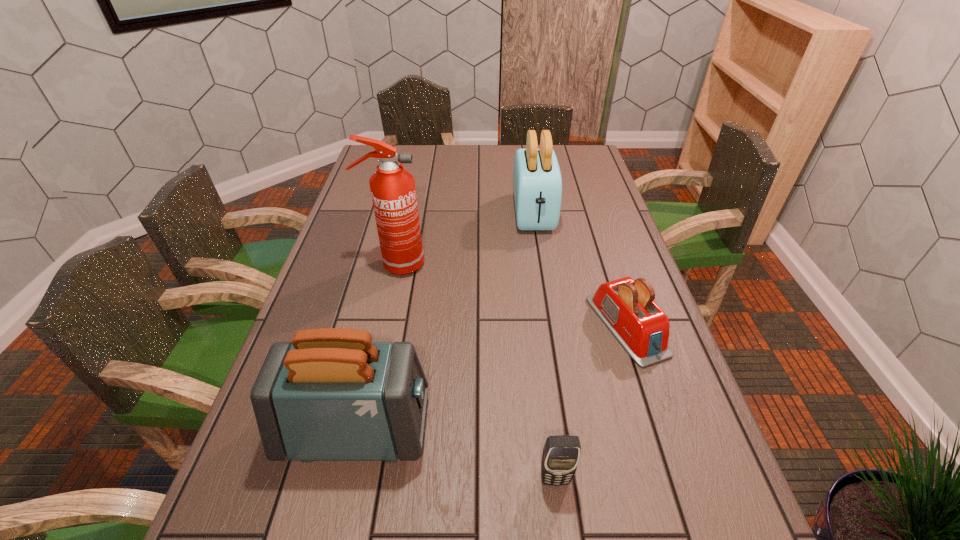
Find the location of a particular element. This screenshot has height=540, width=960. fire extinguisher is located at coordinates (393, 191).

Identify the location of the tallest object. Image resolution: width=960 pixels, height=540 pixels. (393, 191).

Identify the location of the second toaster from right to left. The image size is (960, 540). (537, 184).

The width and height of the screenshot is (960, 540). Find the location of `the farthest object`. the farthest object is located at coordinates (537, 184).

Find the location of a particular element. This screenshot has height=540, width=960. the second nearest object is located at coordinates (331, 394).

Locate an element on the screen. the nearest toaster is located at coordinates (331, 394).

Find the location of a particular element. The height and width of the screenshot is (540, 960). the nearest object is located at coordinates 561,454.

You are a GUI agent. You are given a task and a screenshot of the screen. Output one action in this format:
    pyautogui.click(x=<x>, y=<y>)
    Task: Click on the second nearest toaster
    Image resolution: width=960 pixels, height=540 pixels.
    Given the screenshot: What is the action you would take?
    [627, 308]

At what (x,y) coordinates should I click in order to perform the action: click on the shortest toaster. Please return your answer as a coordinate pair (x, y). Image resolution: width=960 pixels, height=540 pixels. Looking at the image, I should click on (627, 308).

Image resolution: width=960 pixels, height=540 pixels. In order to click on free spot located at the nozzle of the fire extinguisher in this screenshot , I will do `click(442, 265)`.